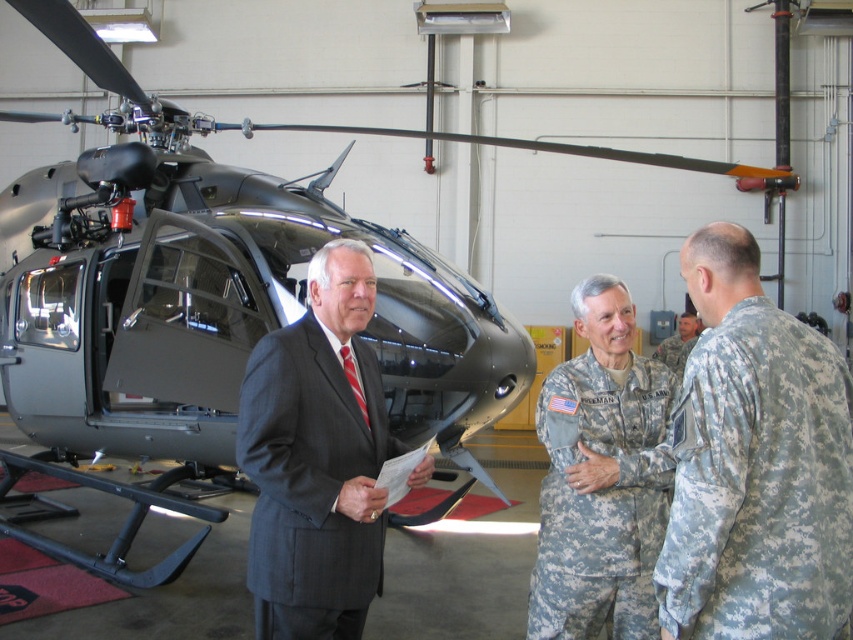
Question: Estimate the real-world distances between objects in this image. Which object is farther from the camouflage uniform at center?

Choices:
 (A) dark gray suit at center
 (B) camouflage fabric uniform at right

Answer: (B)

Question: From the image, what is the correct spatial relationship of camouflage fabric uniform at right in relation to camouflage fabric uniform at center?

Choices:
 (A) below
 (B) above

Answer: (B)

Question: Which point appears farthest from the camera in this image?

Choices:
 (A) (689, 333)
 (B) (782, 573)
 (C) (564, 400)
 (D) (320, 570)

Answer: (A)

Question: Is dark gray suit at center to the left of camouflage uniform at center from the viewer's perspective?

Choices:
 (A) yes
 (B) no

Answer: (A)

Question: Observing the image, what is the correct spatial positioning of camouflage fabric uniform at right in reference to camouflage uniform at center?

Choices:
 (A) right
 (B) left

Answer: (B)

Question: Which object appears farthest from the camera in this image?

Choices:
 (A) dark gray suit at center
 (B) camouflage fabric uniform at right
 (C) camouflage fabric uniform at center

Answer: (C)